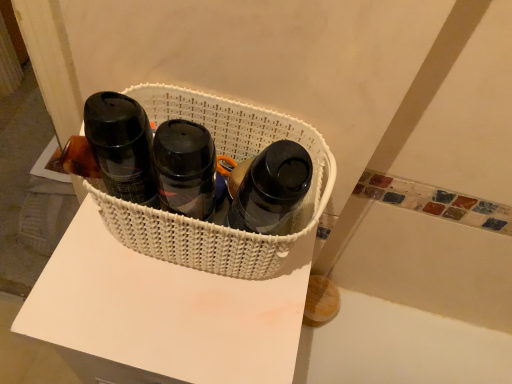
What are the coordinates of `free point to the left of matte black bottle at center, which ranks as the first bottle in right-to-left order` in the screenshot? It's located at (114, 291).